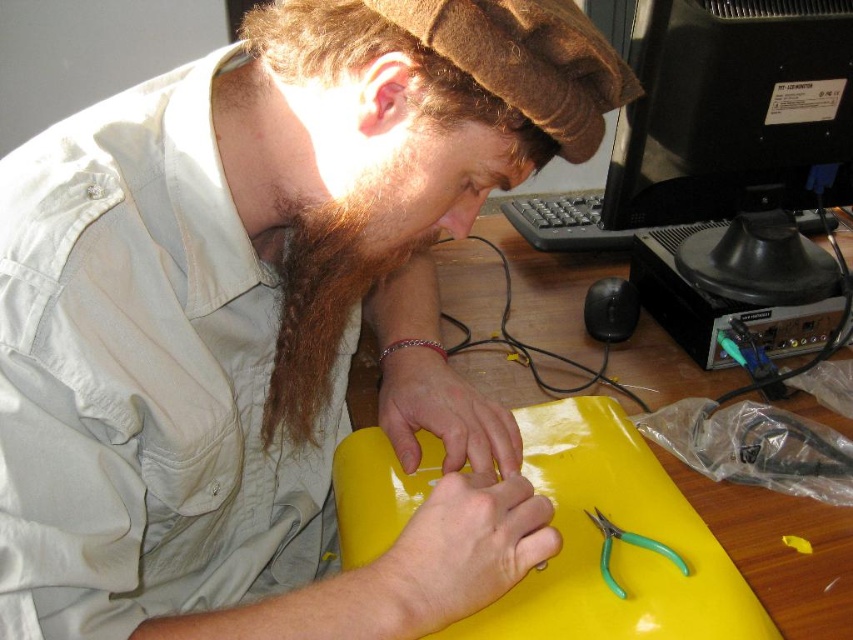
Identify the location of yellow glossy table at center. (782, 550).

Is point (821, 612) positioned behind point (317, 292)?

Yes, point (821, 612) is behind point (317, 292).

Locate an element on the screen. yellow glossy table at center is located at coordinates (782, 550).

Can you confirm if brown fuzzy beard at center is positioned below green plastic pliers at center?

No, brown fuzzy beard at center is not below green plastic pliers at center.

Which is more to the left, brown fuzzy beard at center or green plastic pliers at center?

brown fuzzy beard at center is more to the left.

The image size is (853, 640). What do you see at coordinates (323, 298) in the screenshot?
I see `brown fuzzy beard at center` at bounding box center [323, 298].

The height and width of the screenshot is (640, 853). Identify the location of brown fuzzy beard at center. (323, 298).

Which of these two, yellow plastic wire at center or green plastic pliers at center, stands shorter?

green plastic pliers at center

Can you confirm if yellow plastic wire at center is positioned to the left of green plastic pliers at center?

Correct, you'll find yellow plastic wire at center to the left of green plastic pliers at center.

What do you see at coordinates (534, 346) in the screenshot? The height and width of the screenshot is (640, 853). I see `yellow plastic wire at center` at bounding box center [534, 346].

Locate an element on the screen. The image size is (853, 640). yellow plastic wire at center is located at coordinates tap(534, 346).